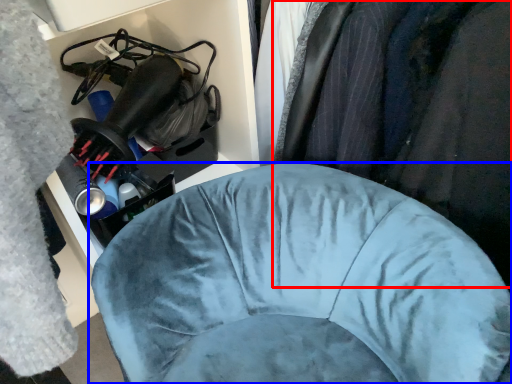
Question: Among these objects, which one is farthest to the camera, clothing (highlighted by a red box) or furniture (highlighted by a blue box)?

Choices:
 (A) clothing
 (B) furniture

Answer: (B)